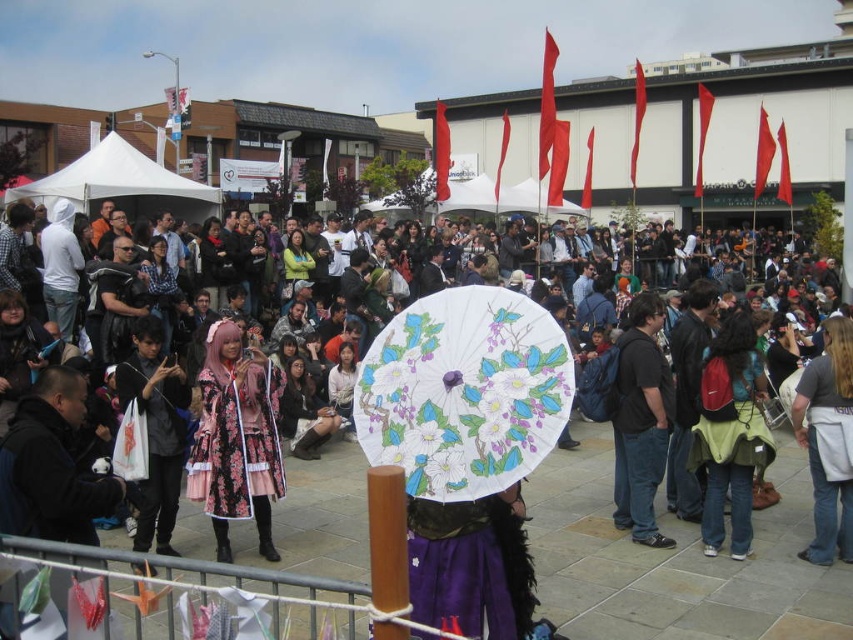
Can you confirm if white paper umbrella at center is positioned to the left of floral fabric dress at center?

In fact, white paper umbrella at center is to the right of floral fabric dress at center.

Between point (376, 374) and point (341, 419), which one is positioned in front?

Point (376, 374) is more forward.

I want to click on white paper umbrella at center, so 463,392.

Is point (440, 452) less distant than point (807, 371)?

Yes, it is.

Is point (442, 378) positioned after point (822, 522)?

No, it is not.

Does point (407, 413) come closer to viewer compared to point (850, 508)?

Yes, it is in front of point (850, 508).

Identify the location of white paper umbrella at center. The height and width of the screenshot is (640, 853). (463, 392).

Who is lower down, floral-patterned fabric dress at center or green fabric jacket at center?

floral-patterned fabric dress at center

From the picture: Between floral-patterned fabric dress at center and green fabric jacket at center, which one has more height?

green fabric jacket at center

Describe the element at coordinates (236, 438) in the screenshot. The image size is (853, 640). I see `floral-patterned fabric dress at center` at that location.

You are a GUI agent. You are given a task and a screenshot of the screen. Output one action in this format:
    pyautogui.click(x=<x>, y=<y>)
    Task: Click on the floral-patterned fabric dress at center
    This screenshot has width=853, height=640.
    Given the screenshot: What is the action you would take?
    pyautogui.click(x=236, y=438)